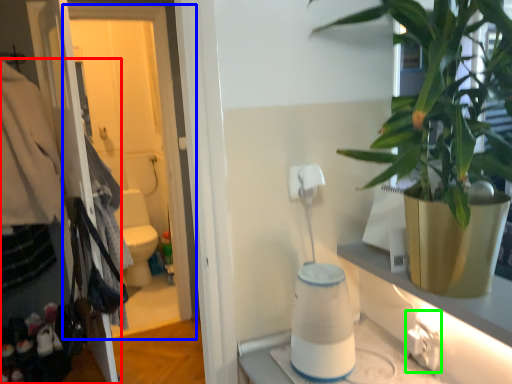
Question: Which object is the closest to the closet (highlighted by a red box)? Choose among these: screen door (highlighted by a blue box) or electric outlet (highlighted by a green box).

Choices:
 (A) screen door
 (B) electric outlet

Answer: (A)